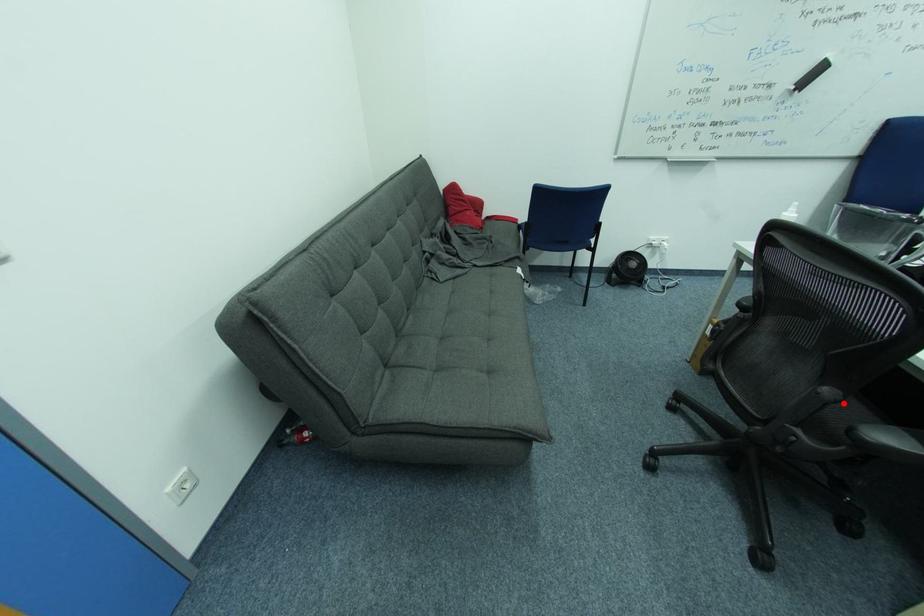
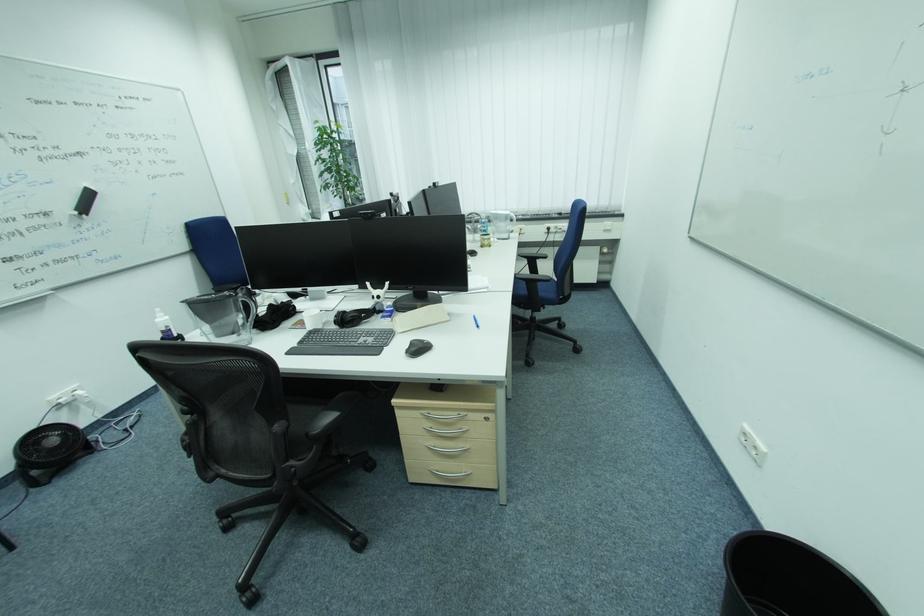
In the second image, find the point that corresponds to the highlighted location in the first image.

(294, 429)